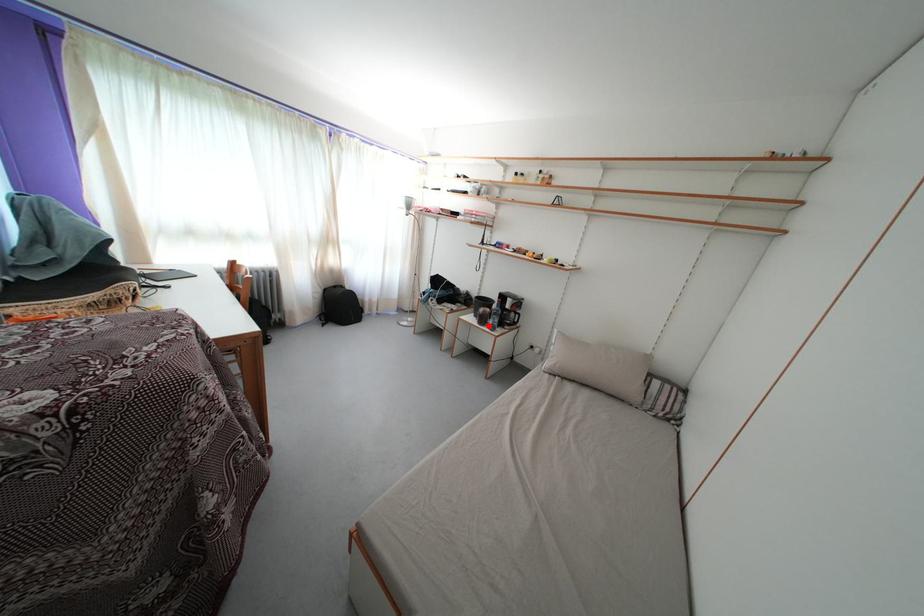
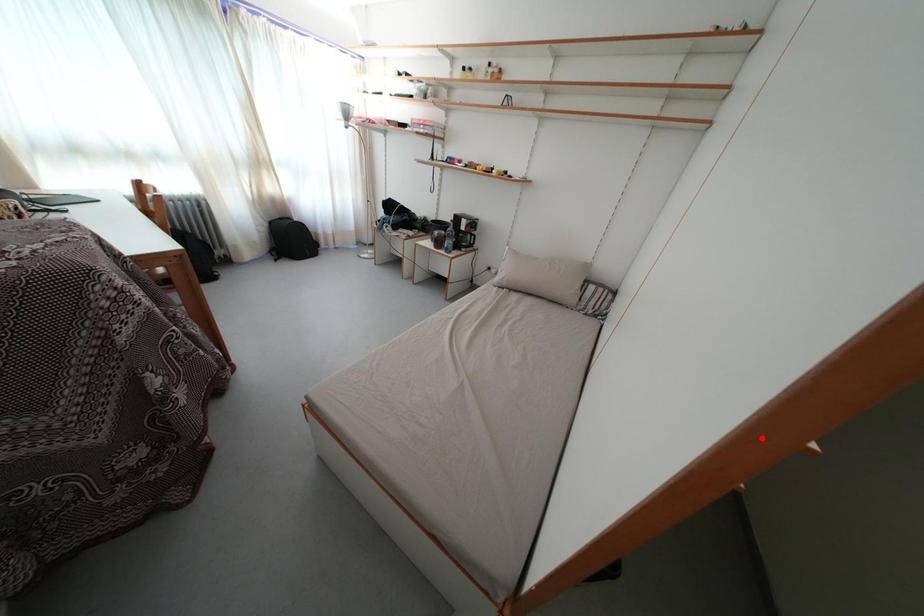
I am providing you with two images of the same scene from different viewpoints. A red point is marked on the first image and another point is marked on the second image. Is the red point in image1 aligned with the point shown in image2?

No